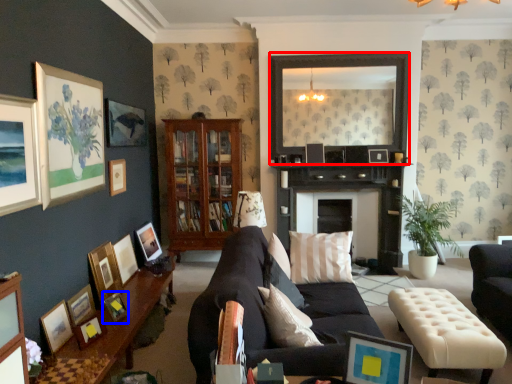
Question: Which object appears farthest to the camera in this image, mirror (highlighted by a red box) or picture frame (highlighted by a blue box)?

Choices:
 (A) mirror
 (B) picture frame

Answer: (A)